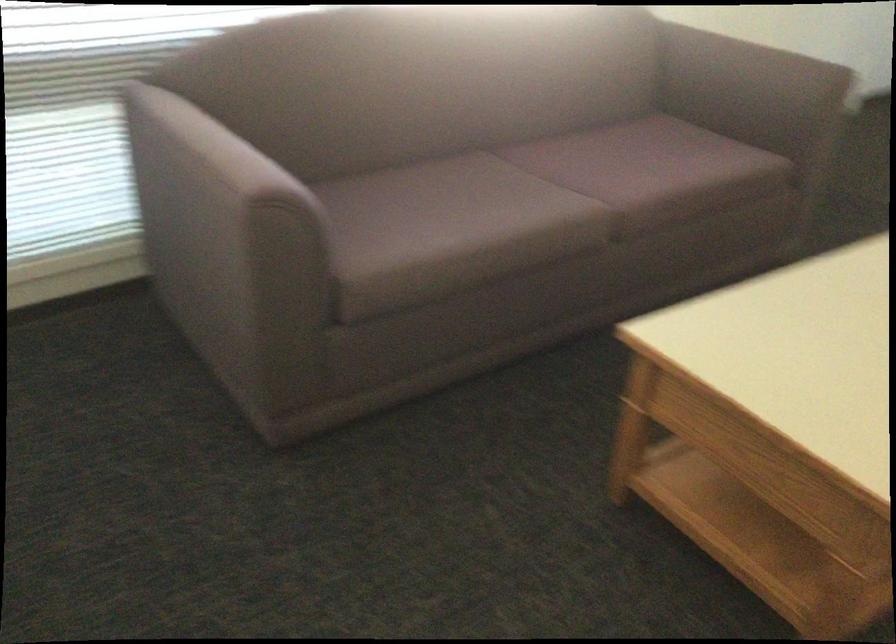
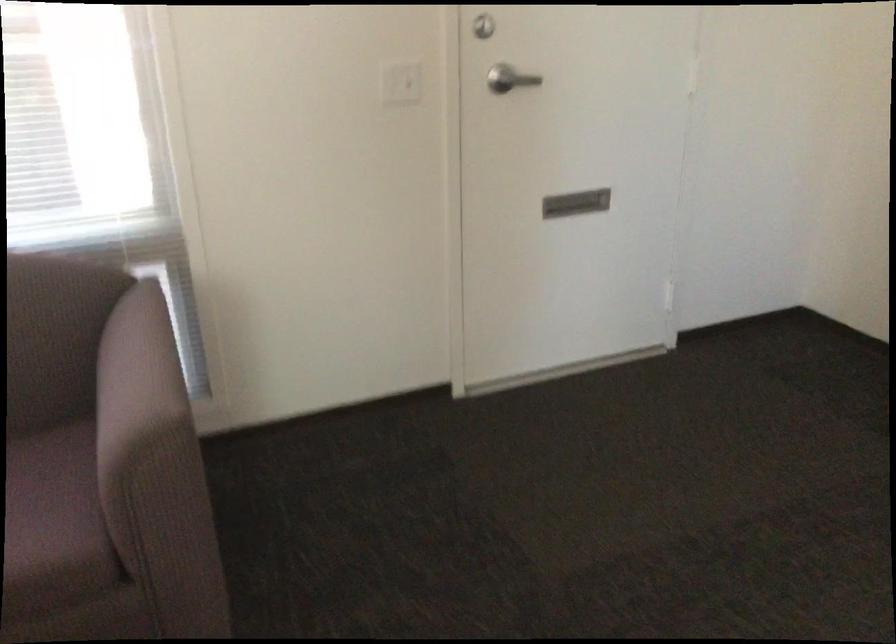
The images are taken continuously from a first-person perspective. In which direction are you moving?

The cameraman moved toward right, forward.